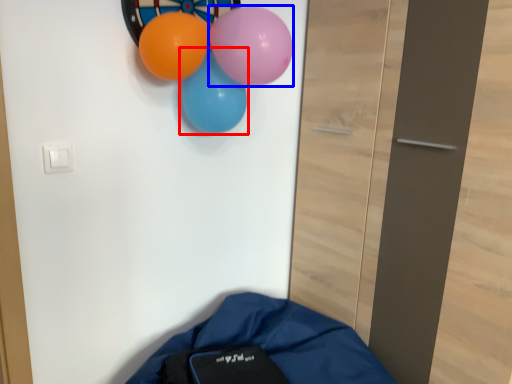
Question: Among these objects, which one is farthest to the camera, balloon (highlighted by a red box) or balloon (highlighted by a blue box)?

Choices:
 (A) balloon
 (B) balloon

Answer: (A)